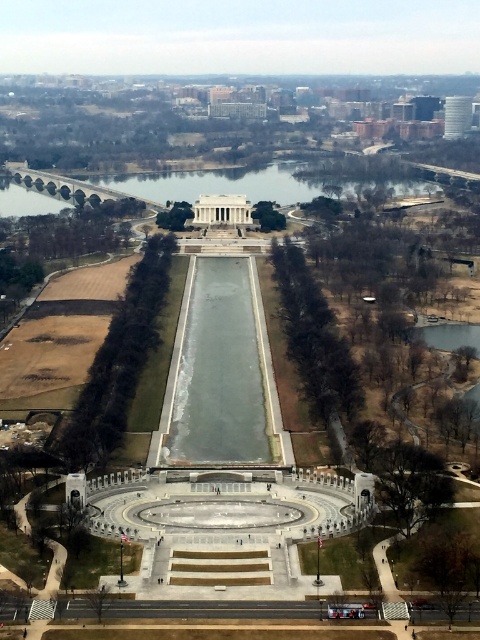
You are an architect designing a new pathway that must pass through the clear glass waterway at center and the clear glass water at center. Which of these two features requires a narrower pathway design?

The clear glass waterway at center requires a narrower pathway design because it occupies less space than the clear glass water at center.